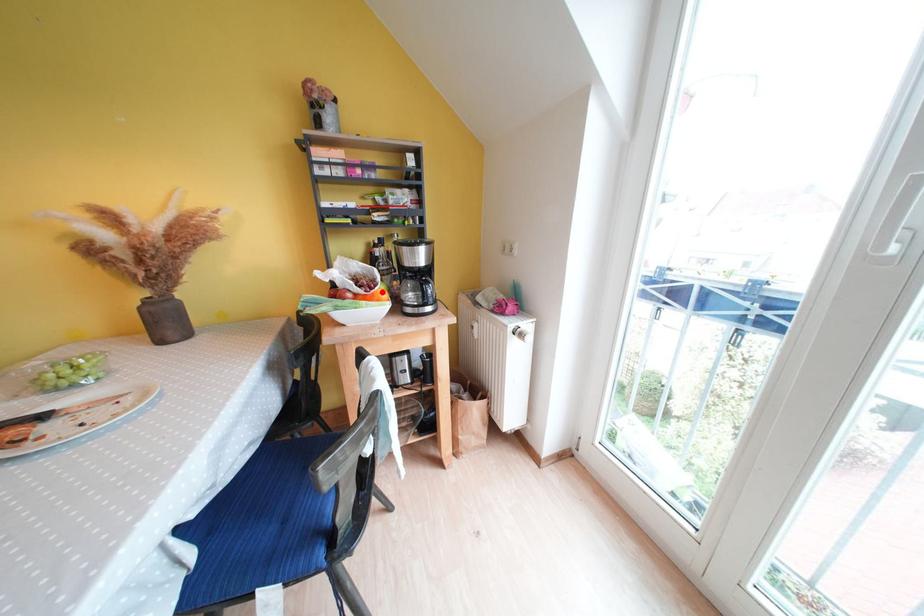
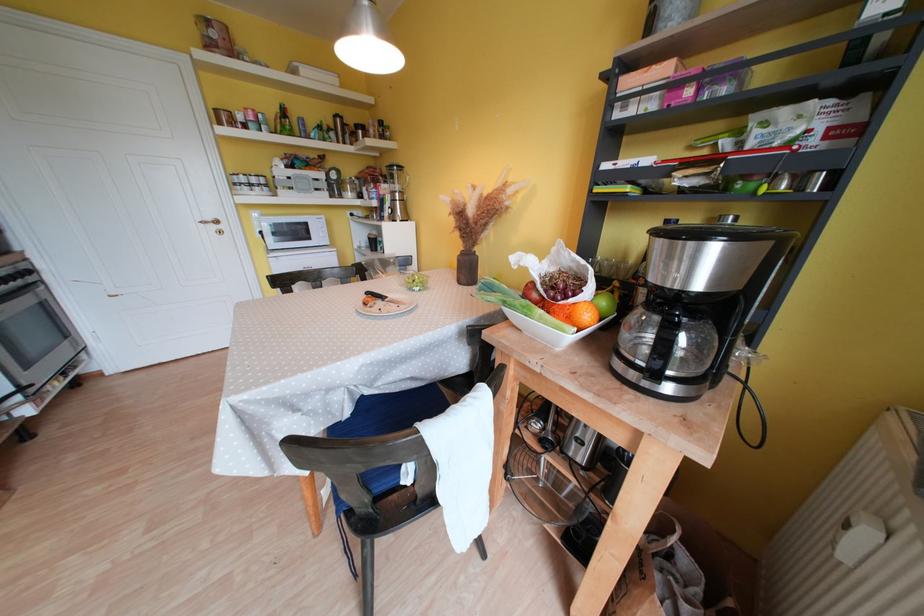
Locate, in the second image, the point that corresponds to the highlighted location in the first image.

(578, 302)